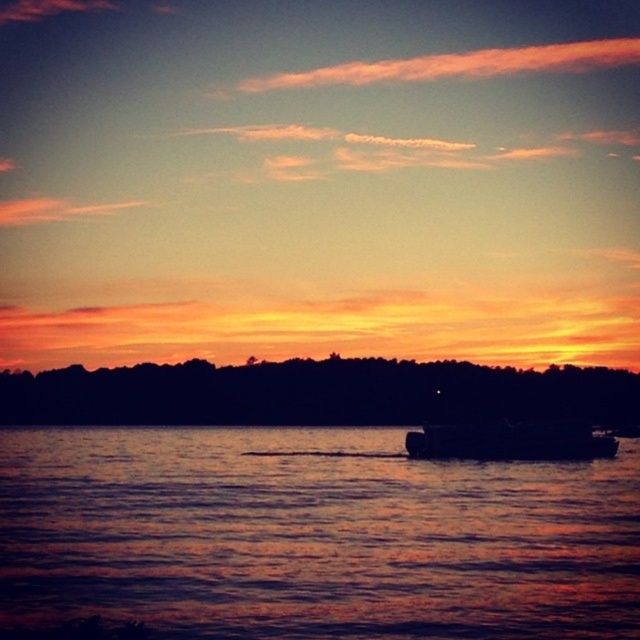
Question: Is shiny reflective water at center positioned at the back of dark gray metallic boat at center?

Choices:
 (A) no
 (B) yes

Answer: (A)

Question: Can you confirm if shiny reflective water at center is positioned below silhouetted trees at lower center?

Choices:
 (A) yes
 (B) no

Answer: (B)

Question: Which of these objects is positioned closest to the silhouetted trees at lower center?

Choices:
 (A) dark gray metallic boat at center
 (B) shiny reflective water at center

Answer: (B)

Question: Which point is closer to the camera?

Choices:
 (A) silhouetted trees at lower center
 (B) shiny reflective water at center

Answer: (B)

Question: Can you confirm if shiny reflective water at center is positioned to the left of silhouetted trees at lower center?

Choices:
 (A) no
 (B) yes

Answer: (A)

Question: Among these objects, which one is farthest from the camera?

Choices:
 (A) dark gray metallic boat at center
 (B) shiny reflective water at center

Answer: (A)